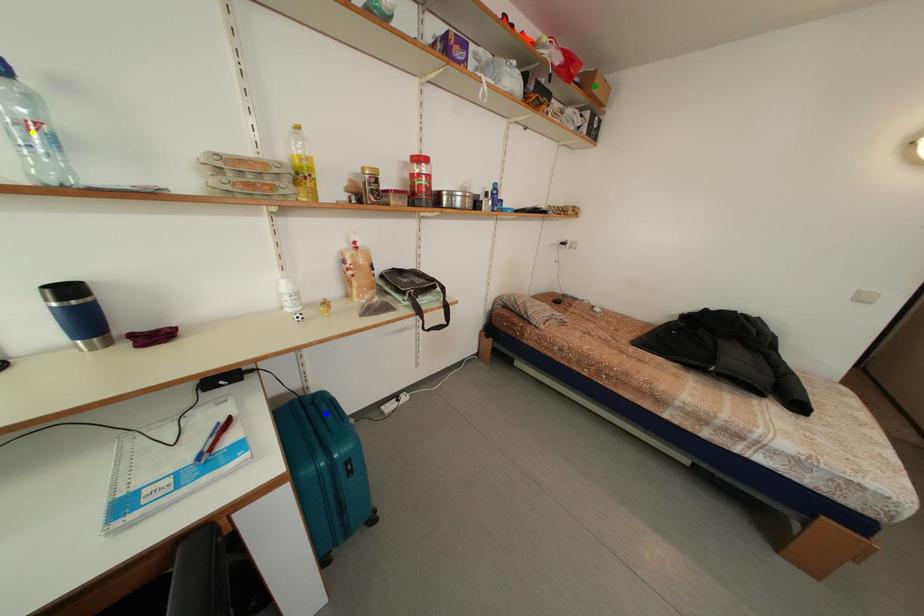
Order these from nearest to farthest:
A) blue point
B) green point
C) yellow point

yellow point → blue point → green point